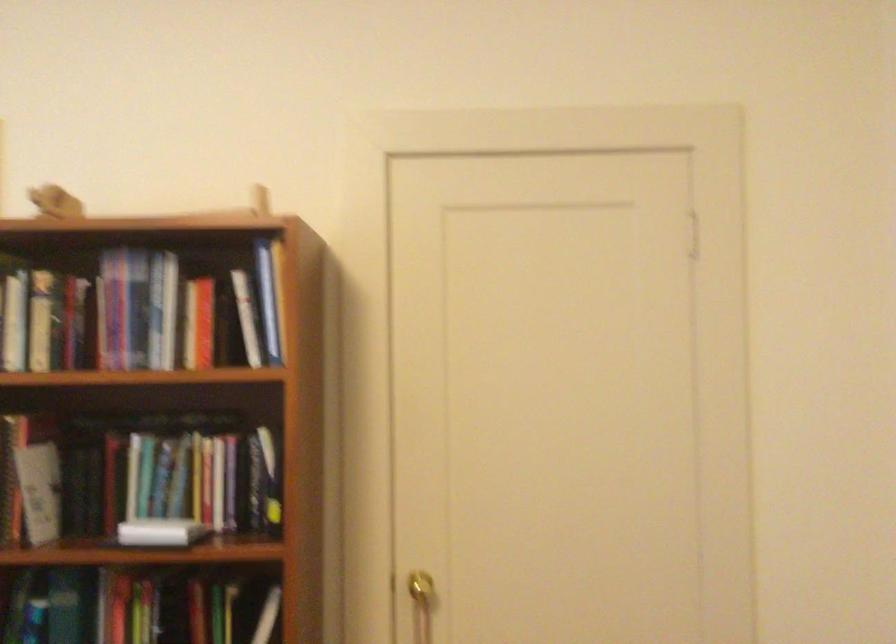
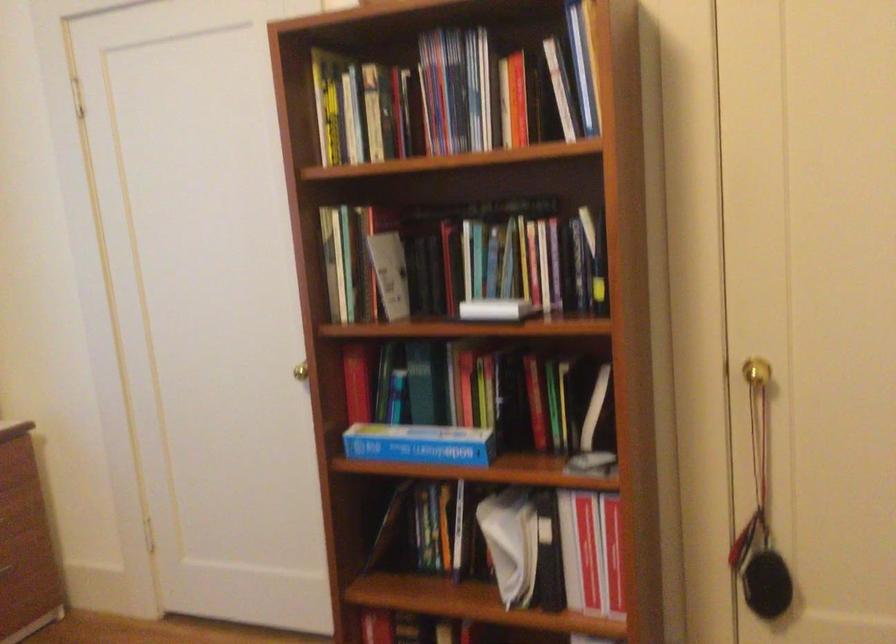
In the second image, find the point that corresponds to point (134, 476) in the first image.

(467, 260)